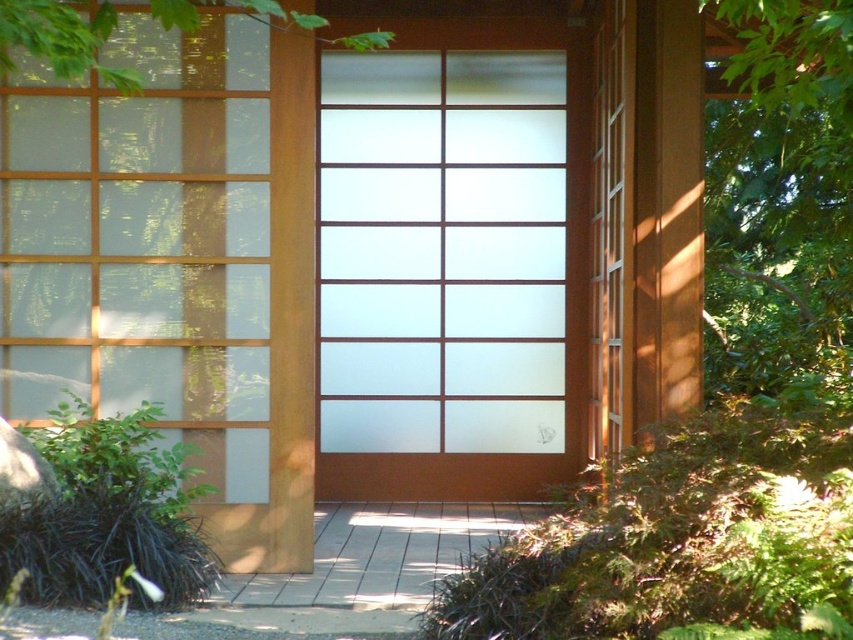
Question: Which point is farther to the camera?

Choices:
 (A) (49, 284)
 (B) (259, 12)

Answer: (A)

Question: Which point is closer to the camera?

Choices:
 (A) (12, 24)
 (B) (241, 237)

Answer: (A)

Question: Is frosted glass window at left to the right of green leafy tree at upper left from the viewer's perspective?

Choices:
 (A) no
 (B) yes

Answer: (A)

Question: Can you confirm if frosted glass window at left is wider than green leafy tree at upper left?

Choices:
 (A) no
 (B) yes

Answer: (A)

Question: Can you confirm if frosted glass window at left is bigger than green leafy tree at upper left?

Choices:
 (A) no
 (B) yes

Answer: (B)

Question: Which point is farther to the camera?

Choices:
 (A) (337, 42)
 (B) (143, 333)

Answer: (A)